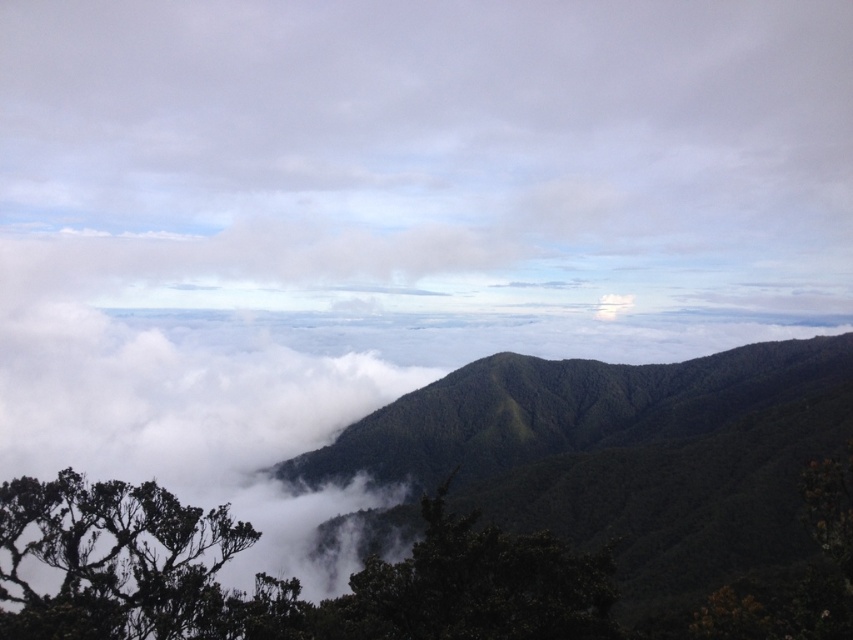
You are a hiker trying to navigate through the mountainous landscape. You have two points marked on your map at coordinates point (524,364) and point (415,563). Which point is closer to the clouds in the background?

Point (524,364) is behind point (415,563), so it is closer to the clouds in the background.

You are a hiker planning to take a photo of the green textured mountain at center and the dark green leafy tree at lower left. Which object should you stand closer to in order to capture both in the same frame?

You should stand closer to the dark green leafy tree at lower left because the green textured mountain at center is much taller, so moving closer to the shorter object helps balance their sizes in the photo.

You are an aerial photographer planning to capture the dark green leafy tree at lower left in the center of your photo. Given its current position at point 0.878, 0.137, how much should you move your camera to the left or right to center it?

To center the dark green leafy tree at lower left, you need to move the camera to the left by approximately 0.878 units horizontally and down by 0.137 units vertically, as its current coordinates are at (115,561).